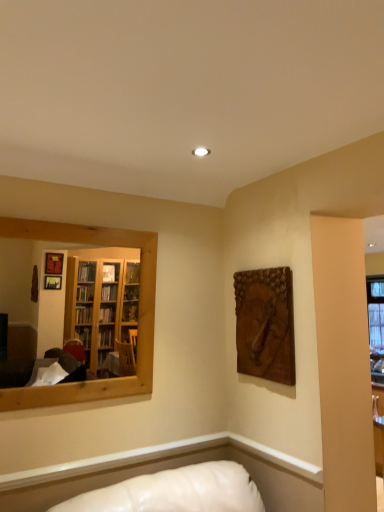
Question: Is point (127, 233) closer or farther from the camera than point (236, 336)?

Choices:
 (A) closer
 (B) farther

Answer: (A)

Question: Based on their positions, is wooden mirror at left located to the left or right of wooden carving at upper right?

Choices:
 (A) left
 (B) right

Answer: (A)

Question: Considering their positions, is wooden mirror at left located in front of or behind wooden carving at upper right?

Choices:
 (A) behind
 (B) front

Answer: (B)

Question: Is wooden carving at upper right inside or outside of wooden mirror at left?

Choices:
 (A) outside
 (B) inside

Answer: (A)

Question: Does point (238, 324) appear closer or farther from the camera than point (67, 228)?

Choices:
 (A) farther
 (B) closer

Answer: (A)

Question: From the image's perspective, relative to wooden mirror at left, is wooden carving at upper right above or below?

Choices:
 (A) above
 (B) below

Answer: (B)

Question: Is wooden carving at upper right wider or thinner than wooden mirror at left?

Choices:
 (A) wide
 (B) thin

Answer: (B)